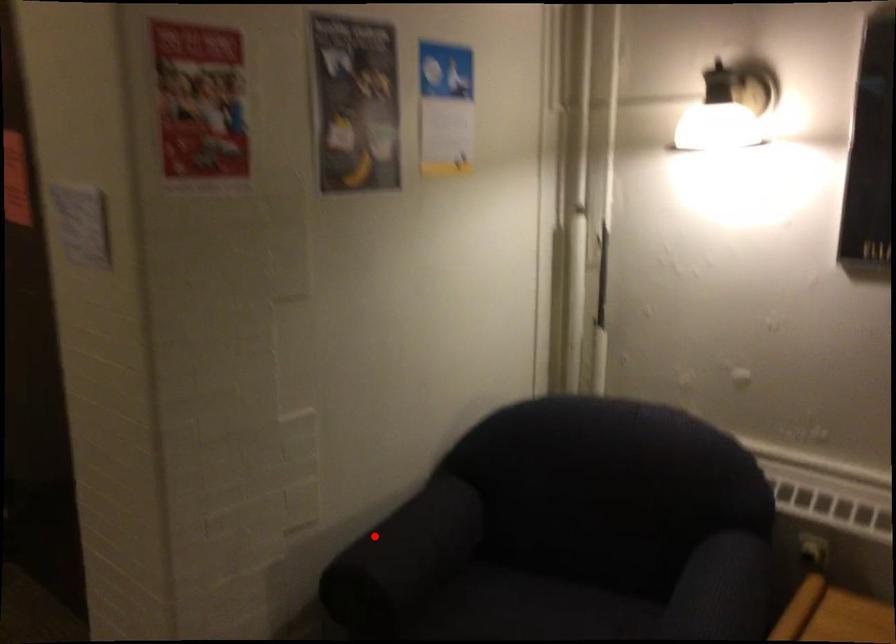
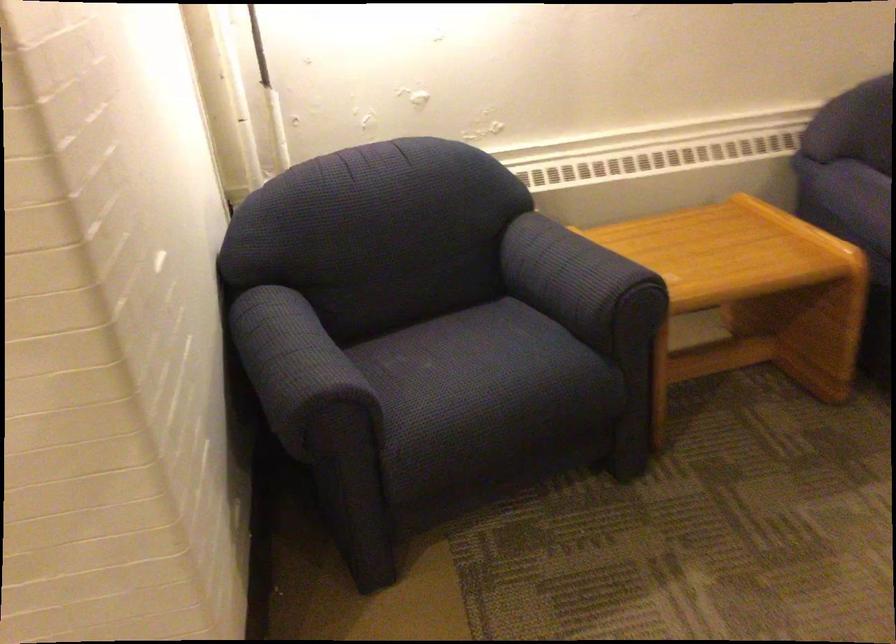
Question: I am providing you with two images of the same scene from different viewpoints. Given a red point in image1, look at the same physical point in image2. Is it:

Choices:
 (A) Closer to the viewpoint
 (B) Farther from the viewpoint

Answer: (A)